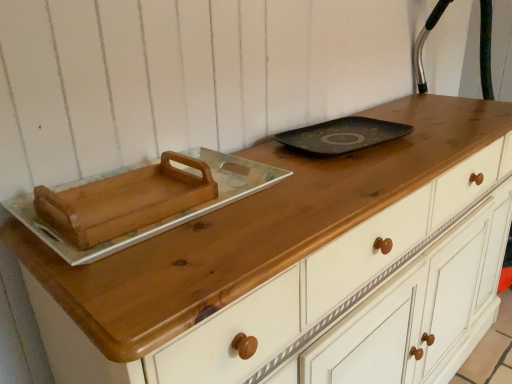
Question: Is black matte tray at center in front of or behind wooden tray at left in the image?

Choices:
 (A) front
 (B) behind

Answer: (B)

Question: Is black matte tray at center taller or shorter than wooden tray at left?

Choices:
 (A) tall
 (B) short

Answer: (B)

Question: Considering the positions of point (321, 152) and point (70, 218), is point (321, 152) closer or farther from the camera than point (70, 218)?

Choices:
 (A) farther
 (B) closer

Answer: (A)

Question: From a real-world perspective, is wooden tray at left above or below black matte tray at center?

Choices:
 (A) below
 (B) above

Answer: (B)

Question: Is wooden tray at left bigger or smaller than black matte tray at center?

Choices:
 (A) small
 (B) big

Answer: (B)

Question: From the image's perspective, is wooden tray at left above or below black matte tray at center?

Choices:
 (A) above
 (B) below

Answer: (B)

Question: Relative to black matte tray at center, is wooden tray at left in front or behind?

Choices:
 (A) front
 (B) behind

Answer: (A)